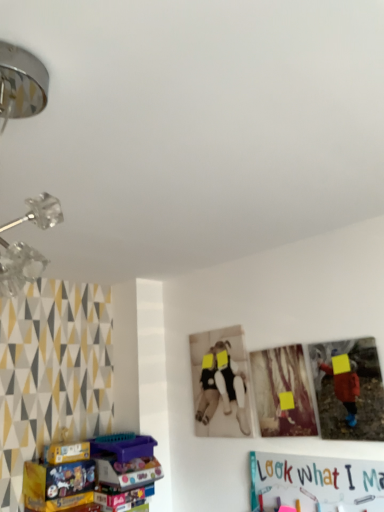
Question: Would you say metallic chrome lamp at upper left is part of matte cardboard box at lower left's contents?

Choices:
 (A) no
 (B) yes

Answer: (A)

Question: Considering the relative sizes of matte cardboard box at lower left and metallic chrome lamp at upper left in the image provided, is matte cardboard box at lower left wider than metallic chrome lamp at upper left?

Choices:
 (A) yes
 (B) no

Answer: (A)

Question: From a real-world perspective, is matte cardboard box at lower left physically above metallic chrome lamp at upper left?

Choices:
 (A) yes
 (B) no

Answer: (B)

Question: From a real-world perspective, is matte cardboard box at lower left physically below metallic chrome lamp at upper left?

Choices:
 (A) yes
 (B) no

Answer: (A)

Question: Does matte cardboard box at lower left have a smaller size compared to metallic chrome lamp at upper left?

Choices:
 (A) no
 (B) yes

Answer: (B)

Question: Is matte cardboard box at lower left taller than metallic chrome lamp at upper left?

Choices:
 (A) no
 (B) yes

Answer: (A)

Question: Is matte cardboard box at lower left positioned before wooden photo frame at center, which is counted as the second picture frame, starting from the right?

Choices:
 (A) yes
 (B) no

Answer: (B)

Question: Can you confirm if matte cardboard box at lower left is wider than wooden photo frame at center, the 1th picture frame in the left-to-right sequence?

Choices:
 (A) yes
 (B) no

Answer: (A)

Question: Could you tell me if matte cardboard box at lower left is turned towards wooden photo frame at center, the 1th picture frame in the left-to-right sequence?

Choices:
 (A) no
 (B) yes

Answer: (A)

Question: Can we say matte cardboard box at lower left lies outside wooden photo frame at center, the 1th picture frame in the left-to-right sequence?

Choices:
 (A) yes
 (B) no

Answer: (A)

Question: Would you consider matte cardboard box at lower left to be distant from wooden photo frame at center, the 1th picture frame in the left-to-right sequence?

Choices:
 (A) no
 (B) yes

Answer: (A)

Question: Does matte cardboard box at lower left have a larger size compared to wooden photo frame at center, the 1th picture frame in the left-to-right sequence?

Choices:
 (A) no
 (B) yes

Answer: (B)

Question: Can you confirm if metallic chrome lamp at upper left is wider than matte cardboard box at lower left?

Choices:
 (A) yes
 (B) no

Answer: (B)